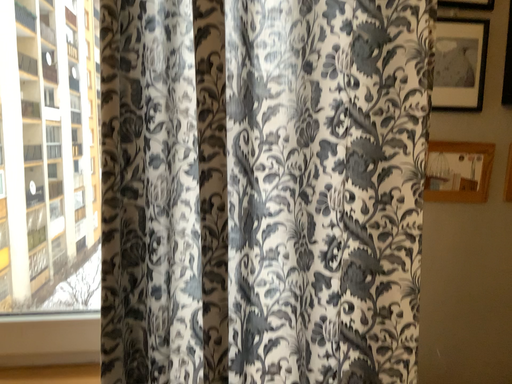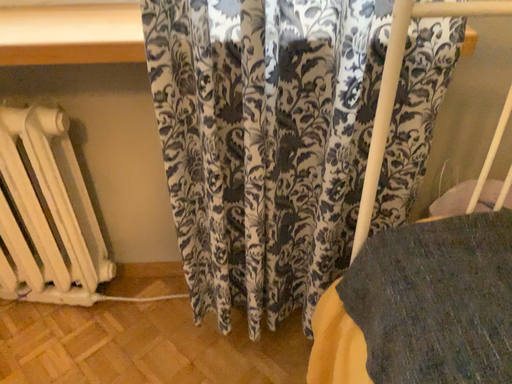
Question: Which way did the camera rotate in the video?

Choices:
 (A) rotated upward
 (B) rotated downward

Answer: (B)